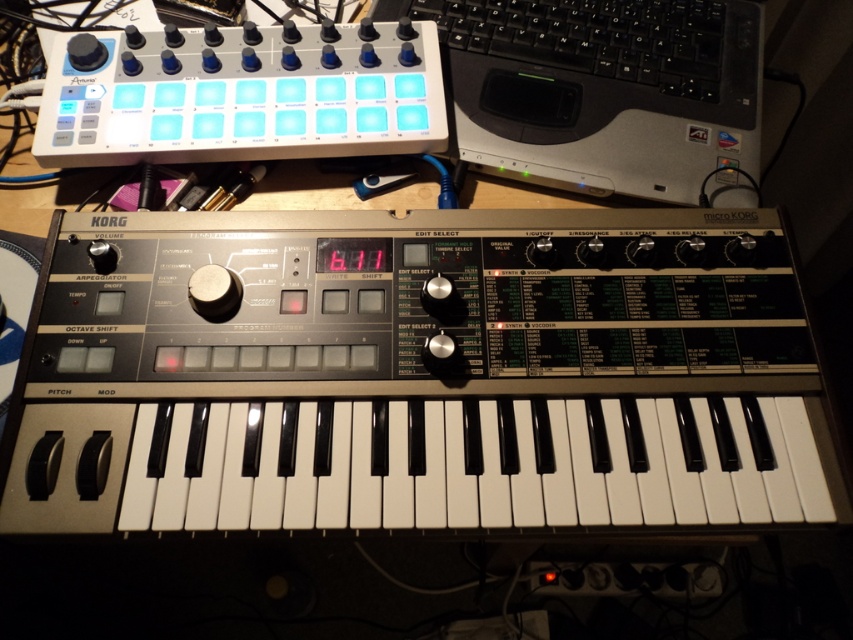
Who is more distant from viewer, (546, 467) or (671, 8)?

The point (671, 8) is more distant.

Can you confirm if metallic silver piano at center is shorter than black plastic keyboard at upper right?

Incorrect, metallic silver piano at center's height does not fall short of black plastic keyboard at upper right's.

Is point (630, 296) less distant than point (463, 17)?

Yes, it is in front of point (463, 17).

You are a GUI agent. You are given a task and a screenshot of the screen. Output one action in this format:
    pyautogui.click(x=<x>, y=<y>)
    Task: Click on the metallic silver piano at center
    
    Given the screenshot: What is the action you would take?
    pos(418,374)

Is blue plastic pads at upper left further to camera compared to black plastic keyboard at upper right?

No, blue plastic pads at upper left is closer to the viewer.

Who is taller, blue plastic pads at upper left or black plastic keyboard at upper right?

blue plastic pads at upper left

Locate an element on the screen. Image resolution: width=853 pixels, height=640 pixels. blue plastic pads at upper left is located at coordinates (241, 93).

Does silver/black plastic laptop at upper right have a greater width compared to black plastic keyboard at upper right?

Yes, silver/black plastic laptop at upper right is wider than black plastic keyboard at upper right.

Can you confirm if silver/black plastic laptop at upper right is shorter than black plastic keyboard at upper right?

No, silver/black plastic laptop at upper right is not shorter than black plastic keyboard at upper right.

I want to click on silver/black plastic laptop at upper right, so click(x=598, y=88).